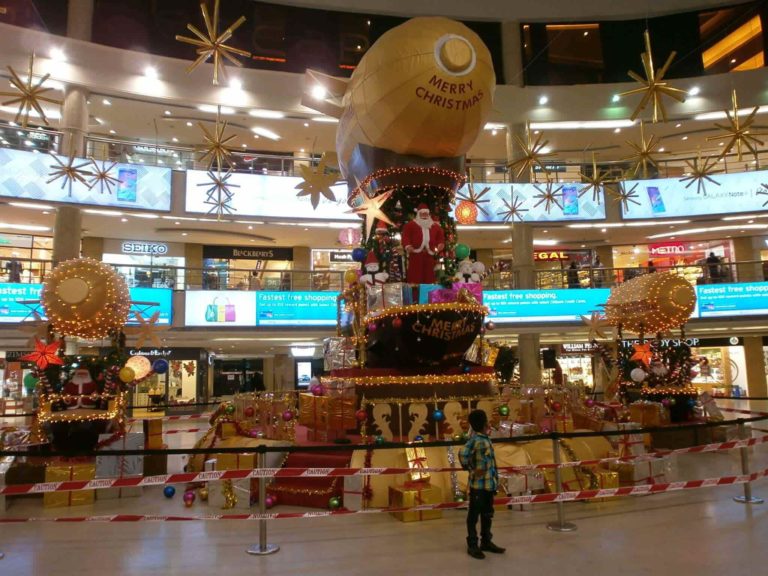
Find the location of `christmas gifts`. christmas gifts is located at coordinates (424, 490), (514, 480), (573, 479), (637, 462), (630, 429), (415, 461).